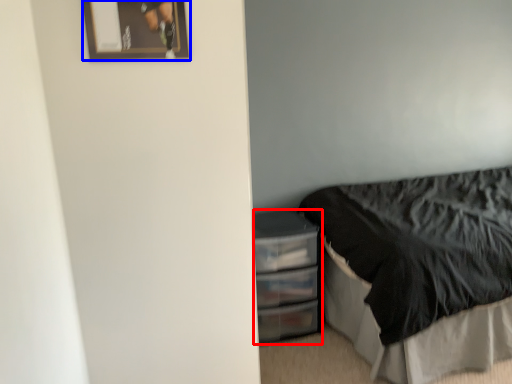
Question: Which point is closer to the camera, file cabinet (highlighted by a red box) or picture frame (highlighted by a blue box)?

Choices:
 (A) file cabinet
 (B) picture frame

Answer: (B)